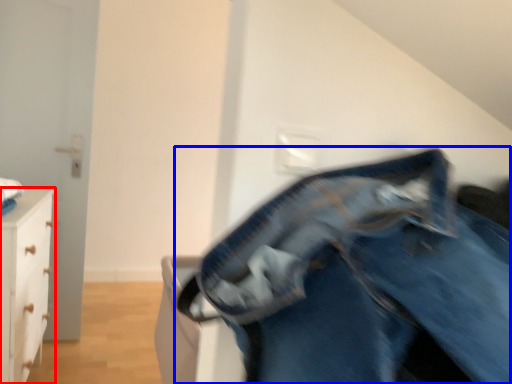
Question: Which object is closer to the camera taking this photo, chest of drawers (highlighted by a red box) or trousers (highlighted by a blue box)?

Choices:
 (A) chest of drawers
 (B) trousers

Answer: (B)